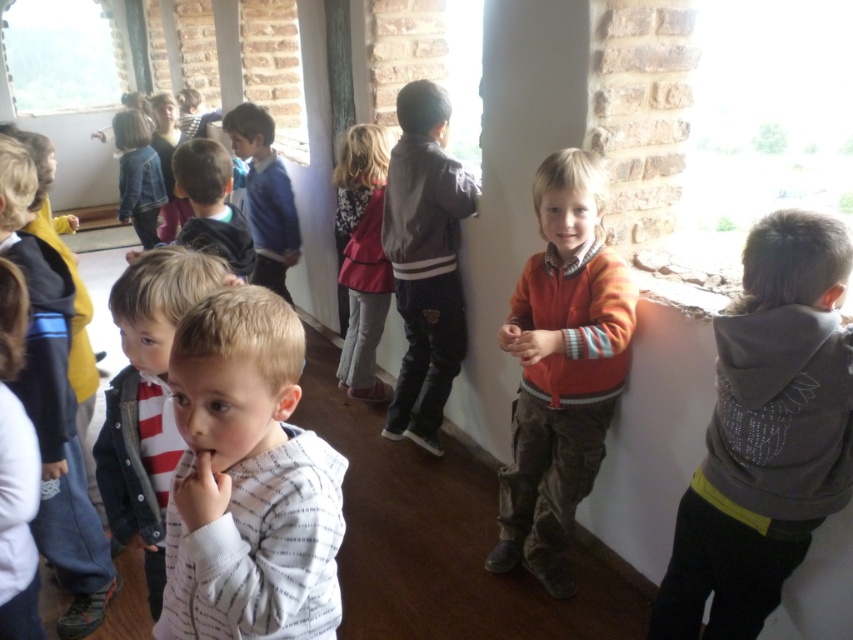
Question: Which point appears farthest from the camera in this image?

Choices:
 (A) (357, 125)
 (B) (160, 552)
 (C) (195, 180)

Answer: (A)

Question: Is transparent glass window at upper left to the right of light brown hair at center from the viewer's perspective?

Choices:
 (A) yes
 (B) no

Answer: (B)

Question: Which object is positioned farthest from the clear glass window at upper right?

Choices:
 (A) white striped shirt at center
 (B) gray hoodie at right
 (C) light brown hair at center
 (D) light pink fabric dress at center

Answer: (A)

Question: In this image, where is clear glass window at upper right located relative to transparent glass window at upper left?

Choices:
 (A) below
 (B) above

Answer: (A)

Question: Which point is farther from the camera taking this photo?

Choices:
 (A) (221, 253)
 (B) (672, 589)

Answer: (A)

Question: Is gray hoodie at right behind dark gray leather jacket at center?

Choices:
 (A) no
 (B) yes

Answer: (A)